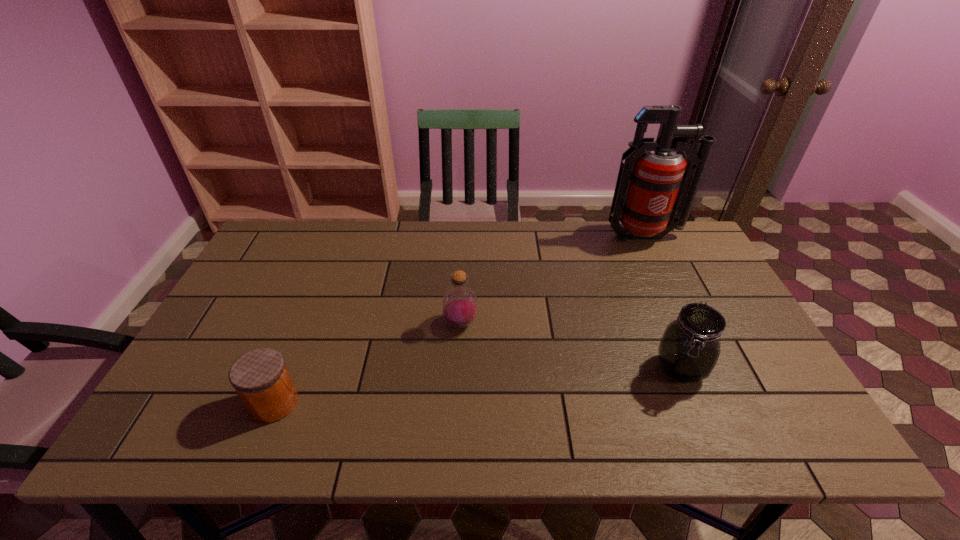
You are a GUI agent. You are given a task and a screenshot of the screen. Output one action in this format:
    pyautogui.click(x=<x>, y=<y>)
    Task: Click on the free space at the near left corner of the desktop
    The height and width of the screenshot is (540, 960).
    Given the screenshot: What is the action you would take?
    pyautogui.click(x=202, y=426)

This screenshot has height=540, width=960. Identify the location of free space between the fire extinguisher and the second farthest object. (552, 280).

I want to click on vacant area between the right jar and the fire extinguisher, so click(662, 302).

Identify the location of free space between the third nearest object and the fire extinguisher. Image resolution: width=960 pixels, height=540 pixels. (552, 280).

The height and width of the screenshot is (540, 960). I want to click on vacant area between the taller jar and the leftmost object, so click(477, 386).

Locate an element on the screen. Image resolution: width=960 pixels, height=540 pixels. free space between the tallest object and the taller jar is located at coordinates point(662,302).

Where is `free spot between the taller jar and the second farthest object`? The height and width of the screenshot is (540, 960). free spot between the taller jar and the second farthest object is located at coordinates (570, 346).

Locate an element on the screen. vacant area between the taller jar and the third object from right to left is located at coordinates (570, 346).

Identify the location of vacant space in between the taller jar and the tallest object. [x=662, y=302].

Identify the location of empty location between the taller jar and the farthest object. This screenshot has height=540, width=960. (662, 302).